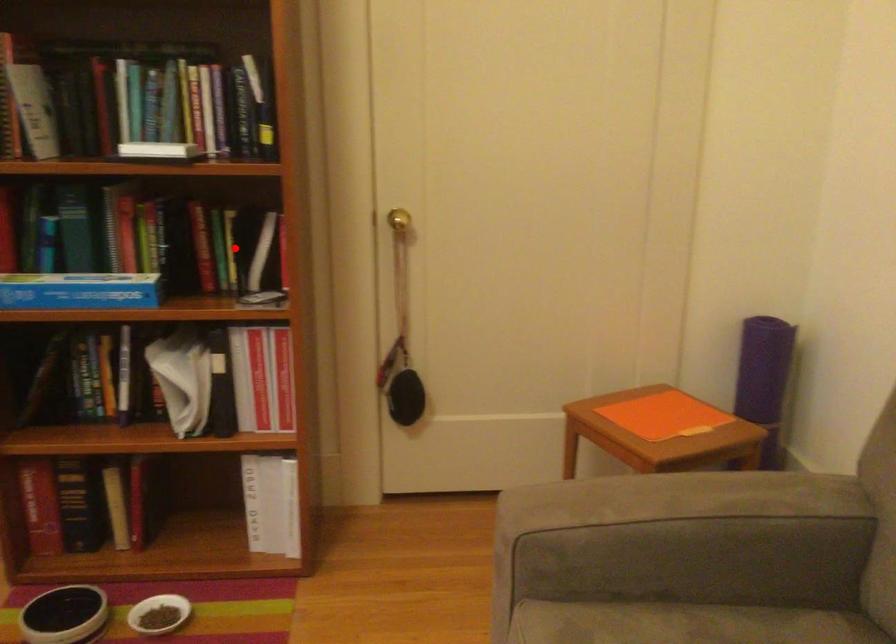
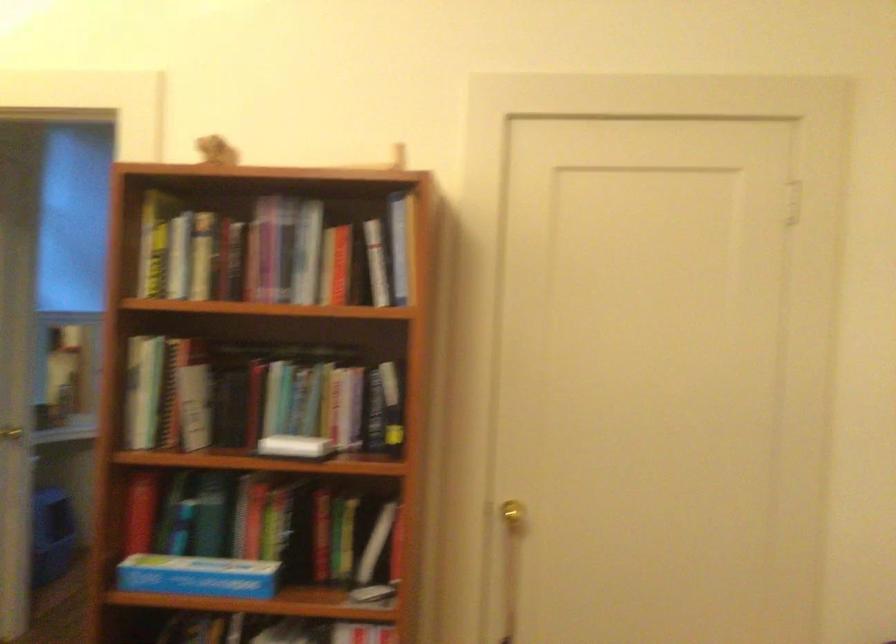
The point at the highlighted location is marked in the first image. Where is the corresponding point in the second image?

(351, 536)